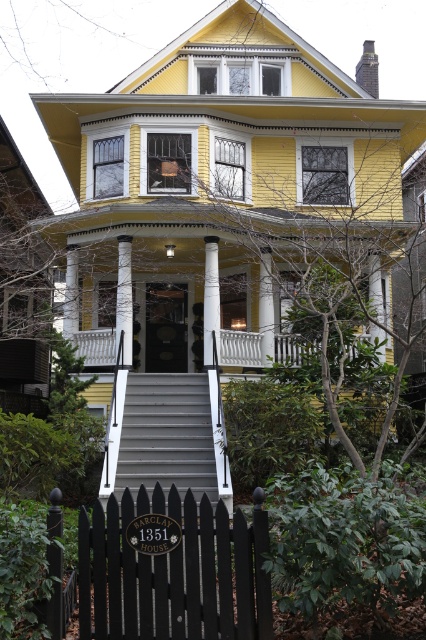
Between smooth gray stairs at center and white painted wood porch at center, which one appears on the right side from the viewer's perspective?

From the viewer's perspective, white painted wood porch at center appears more on the right side.

Which is behind, point (226, 467) or point (285, 336)?

Positioned behind is point (285, 336).

Which is behind, point (224, 476) or point (302, 339)?

The point (302, 339) is behind.

Locate an element on the screen. The image size is (426, 640). smooth gray stairs at center is located at coordinates (166, 436).

Is point (83, 580) behind point (206, 246)?

No, (83, 580) is closer to viewer.

Can you confirm if black wood picket fence at lower left is smaller than white glossy pillar at center?

No.

Which is in front, point (233, 625) or point (213, 326)?

Point (233, 625)

This screenshot has height=640, width=426. Find the location of `black wood picket fence at lower left`. black wood picket fence at lower left is located at coordinates (173, 572).

Is white painted wood balustrade at center smaller than white glossy pillar at center?

Actually, white painted wood balustrade at center might be larger than white glossy pillar at center.

Between point (264, 349) and point (210, 266), which one is positioned behind?

The point (264, 349) is more distant.

Which is in front, point (296, 349) or point (210, 358)?

Point (210, 358)

Identify the location of white painted wood balustrade at center. (244, 348).